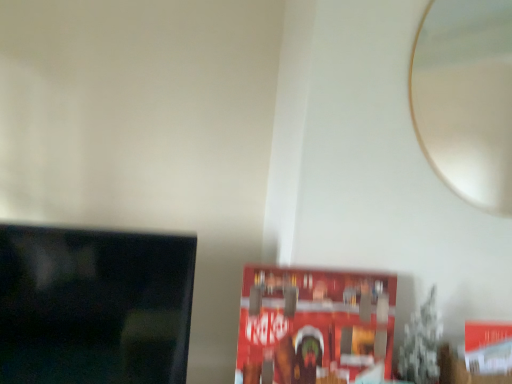
Image resolution: width=512 pixels, height=384 pixels. What do you see at coordinates (314, 325) in the screenshot?
I see `red matte paperback book at center` at bounding box center [314, 325].

Measure the distance between white glossy mirror at upper right and camera.

white glossy mirror at upper right is 7.49 feet away from camera.

This screenshot has height=384, width=512. Describe the element at coordinates (94, 306) in the screenshot. I see `black glossy tv at left` at that location.

Locate an element on the screen. The width and height of the screenshot is (512, 384). red matte paperback book at center is located at coordinates (314, 325).

Would you say black glossy tv at left is to the left or to the right of white glossy mirror at upper right in the picture?

In the image, black glossy tv at left appears on the left side of white glossy mirror at upper right.

What's the angular difference between black glossy tv at left and white glossy mirror at upper right's facing directions?

There is a 0.309-degree angle between the facing directions of black glossy tv at left and white glossy mirror at upper right.

Which is behind, black glossy tv at left or white glossy mirror at upper right?

white glossy mirror at upper right is more distant.

Choose the correct answer: Is black glossy tv at left inside white glossy mirror at upper right or outside it?

black glossy tv at left lies outside white glossy mirror at upper right.

Can you confirm if white glossy mirror at upper right is thinner than black glossy tv at left?

Yes, white glossy mirror at upper right is thinner than black glossy tv at left.

Find the location of `television in front of the white glossy mirror at upper right`. television in front of the white glossy mirror at upper right is located at coordinates (94, 306).

Which object is closer to the camera, white glossy mirror at upper right or black glossy tv at left?

black glossy tv at left is more forward.

Could you tell me if white glossy mirror at upper right is turned towards black glossy tv at left?

No, white glossy mirror at upper right is not turned towards black glossy tv at left.

Is red matte paperback book at center positioned before white glossy mirror at upper right?

That is True.

Is point (359, 348) positioned after point (497, 102)?

No, (359, 348) is in front of (497, 102).

Is red matte paperback book at center turned away from white glossy mirror at upper right?

red matte paperback book at center is not turned away from white glossy mirror at upper right.

In the scene shown: Between red matte paperback book at center and white glossy mirror at upper right, which one has smaller size?

Smaller between the two is white glossy mirror at upper right.

Who is shorter, black glossy tv at left or red matte paperback book at center?

With less height is red matte paperback book at center.

Which of these two, black glossy tv at left or red matte paperback book at center, is wider?

black glossy tv at left.

In the scene shown: How many degrees apart are the facing directions of black glossy tv at left and red matte paperback book at center?

black glossy tv at left and red matte paperback book at center are facing 2.15 degrees away from each other.

Could you tell me if black glossy tv at left is facing red matte paperback book at center?

No, black glossy tv at left is not aimed at red matte paperback book at center.

Between point (335, 320) and point (18, 311), which one is positioned in front?

The point (18, 311) is closer to the camera.

Would you say red matte paperback book at center is to the left or to the right of black glossy tv at left in the picture?

Clearly, red matte paperback book at center is on the right of black glossy tv at left in the image.

Which of these two, red matte paperback book at center or black glossy tv at left, is smaller?

Smaller between the two is red matte paperback book at center.

How different are the orientations of red matte paperback book at center and black glossy tv at left in degrees?

The facing directions of red matte paperback book at center and black glossy tv at left are 2.15 degrees apart.

Are white glossy mirror at upper right and red matte paperback book at center beside each other?

No, white glossy mirror at upper right is not in contact with red matte paperback book at center.

From the image's perspective, is white glossy mirror at upper right located beneath red matte paperback book at center?

Incorrect, from the image's perspective, white glossy mirror at upper right is higher than red matte paperback book at center.

Is white glossy mirror at upper right aimed at red matte paperback book at center?

No, white glossy mirror at upper right is not facing towards red matte paperback book at center.

Which object is further away from the camera taking this photo, white glossy mirror at upper right or red matte paperback book at center?

white glossy mirror at upper right is behind.

You are a GUI agent. You are given a task and a screenshot of the screen. Output one action in this format:
    pyautogui.click(x=<x>, y=<y>)
    Task: Click on the television on the left of the white glossy mirror at upper right
    Image resolution: width=512 pixels, height=384 pixels.
    Given the screenshot: What is the action you would take?
    pyautogui.click(x=94, y=306)

Where is `television that appears in front of the white glossy mirror at upper right`? television that appears in front of the white glossy mirror at upper right is located at coordinates (94, 306).

When comparing their distances from red matte paperback book at center, does black glossy tv at left or white glossy mirror at upper right seem closer?

black glossy tv at left is closer to red matte paperback book at center.

Which object lies further to the anchor point black glossy tv at left, white glossy mirror at upper right or red matte paperback book at center?

Among the two, white glossy mirror at upper right is located further to black glossy tv at left.

Estimate the real-world distances between objects in this image. Which object is further from white glossy mirror at upper right, red matte paperback book at center or black glossy tv at left?

Based on the image, black glossy tv at left appears to be further to white glossy mirror at upper right.

When comparing their distances from white glossy mirror at upper right, does black glossy tv at left or red matte paperback book at center seem closer?

red matte paperback book at center lies closer to white glossy mirror at upper right than the other object.

When comparing their distances from black glossy tv at left, does red matte paperback book at center or white glossy mirror at upper right seem further?

white glossy mirror at upper right.

Based on their spatial positions, is white glossy mirror at upper right or black glossy tv at left further from red matte paperback book at center?

white glossy mirror at upper right.

Find the location of a particular element. paperback book between black glossy tv at left and white glossy mirror at upper right from left to right is located at coordinates (314, 325).